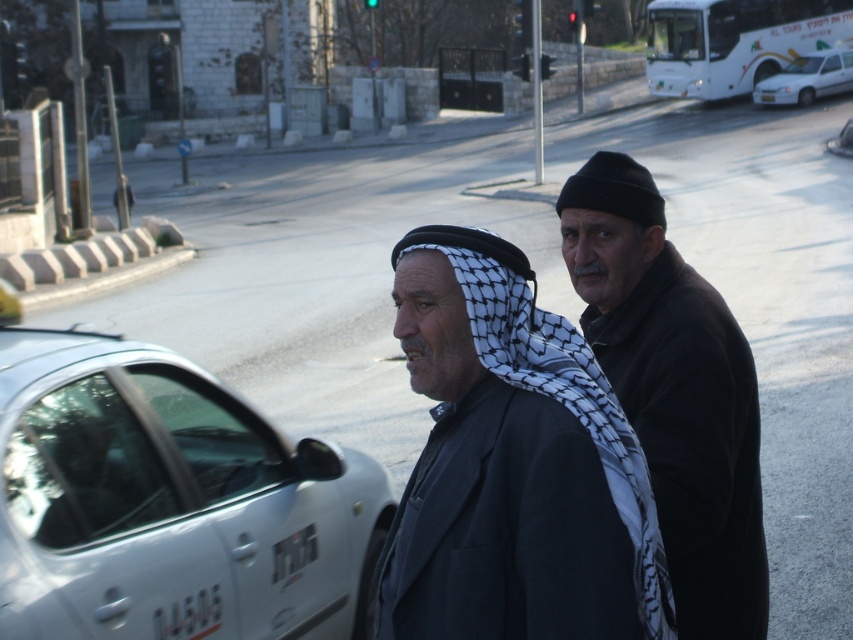
Can you confirm if white glossy car at upper right is wider than metallic silver car at right?

Yes.

Does white glossy car at upper right have a greater height compared to metallic silver car at right?

Yes.

Where is `white glossy car at upper right`? This screenshot has width=853, height=640. white glossy car at upper right is located at coordinates (807, 77).

Can you confirm if white matte bus at upper right is thinner than white glossy car at upper right?

Incorrect, white matte bus at upper right's width is not less than white glossy car at upper right's.

Is point (781, 35) farther from viewer compared to point (849, 52)?

Yes, it is.

The width and height of the screenshot is (853, 640). In order to click on white matte bus at upper right in this screenshot , I will do `click(734, 42)`.

Who is positioned more to the right, white matte car at left or white matte bus at upper right?

Positioned to the right is white matte bus at upper right.

Can you confirm if white matte car at left is wider than white matte bus at upper right?

Incorrect, white matte car at left's width does not surpass white matte bus at upper right's.

Measure the distance between white matte car at left and camera.

3.34 meters

At what (x,y) coordinates should I click in order to perform the action: click on white matte car at left. Please return your answer as a coordinate pair (x, y). The image size is (853, 640). Looking at the image, I should click on (170, 502).